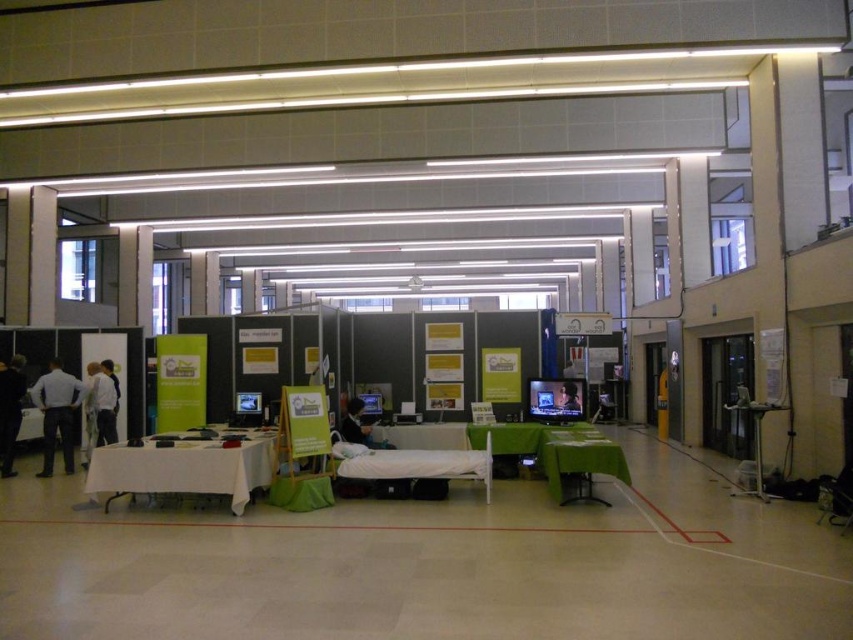
You are setting up for an event and need to adjust the lighting. The white fabric table at center is casting a shadow on the matte black monitor at center. Which object should you move to prevent the shadow from affecting the monitor?

The white fabric table at center is below the matte black monitor at center, so moving the white fabric table at center away from directly underneath the monitor would prevent its shadow from affecting it.

You are a technician who needs to connect the white fabric table at center and the matte black monitor at center using an extension cable that is 5 meters long. Can you safely connect them without needing a second cable?

The distance between the white fabric table at center and the matte black monitor at center is 4.64 meters. Since the extension cable is 5 meters long, which is longer than the distance, you can safely connect them without needing a second cable.